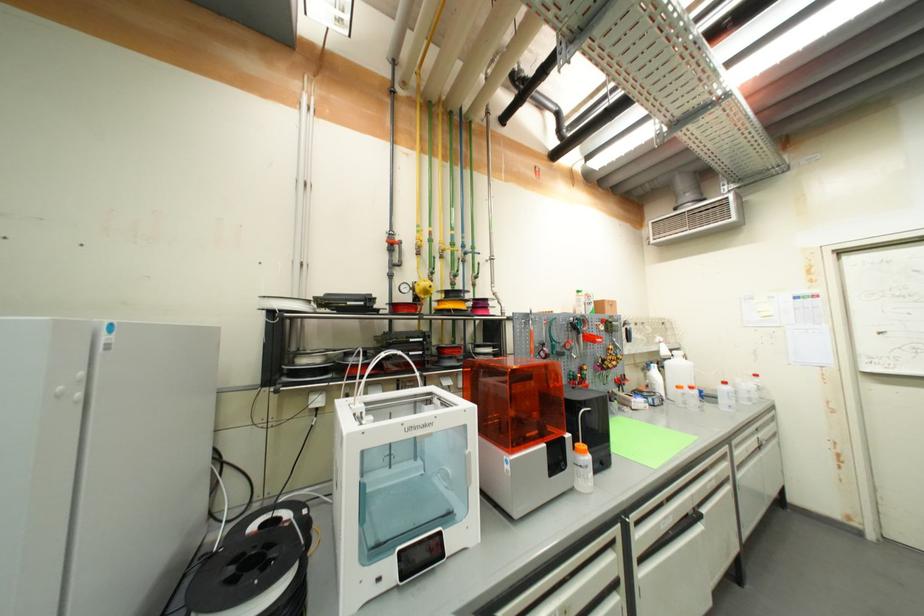
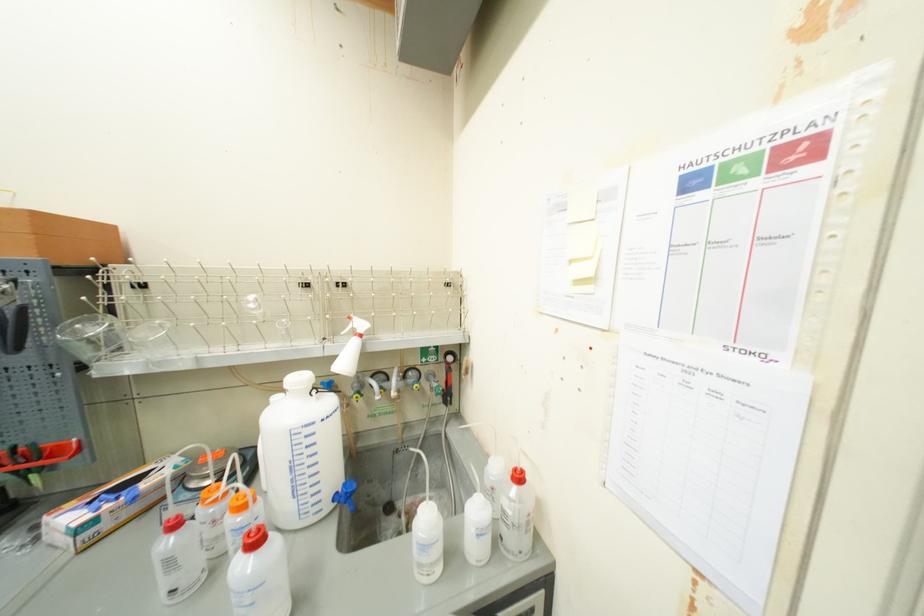
In a continuous first-person perspective shot, in which direction is the camera moving?

The cameraman moved toward right, forward.